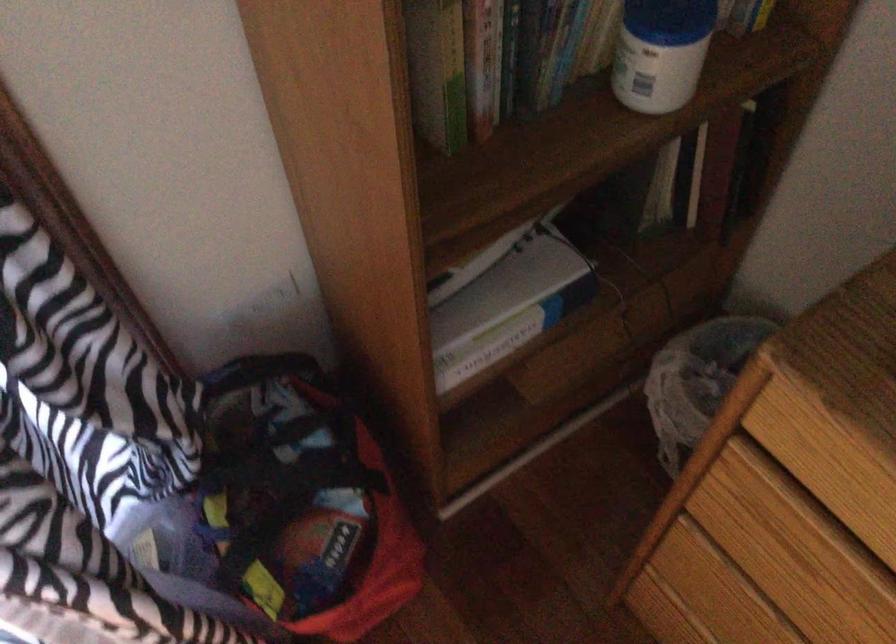
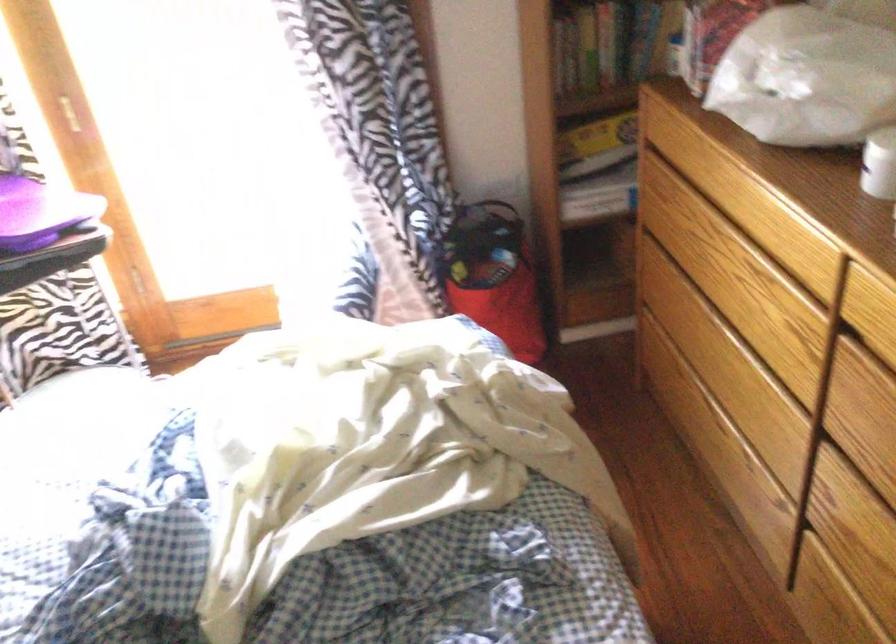
Where in the second image is the point corresponding to point 486,261 from the first image?

(597, 136)